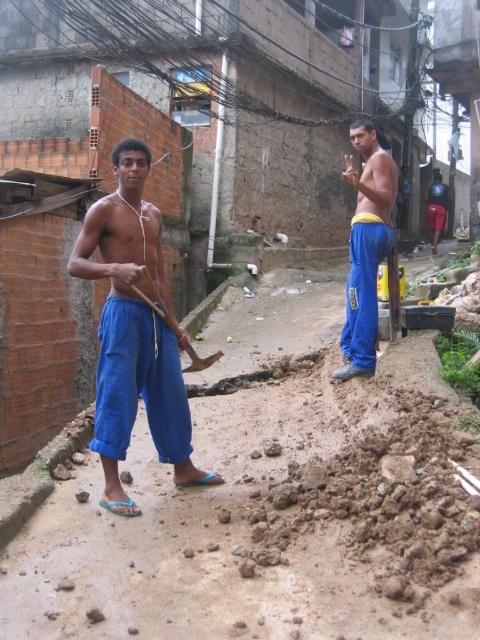
You are standing in the alleyway and want to place a small marker at the point closer to you. Which point should you choose between point (x=360, y=208) and point (x=184, y=369)?

You should choose point (x=360, y=208) because it is closer to you compared to point (x=184, y=369).

You are a delivery person trying to navigate through the alleyway. There are two men wearing blue cotton pants at left and blue cotton pants at center. Which man is closer to you as you enter the alleyway?

The blue cotton pants at left is in front of the blue cotton pants at center, so the man wearing blue cotton pants at left is closer to you as you enter the alleyway.